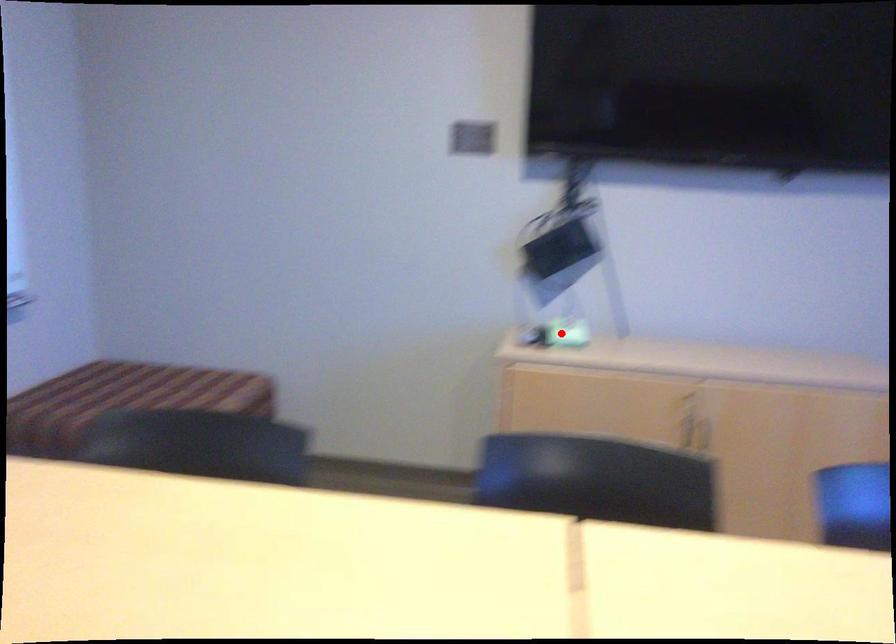
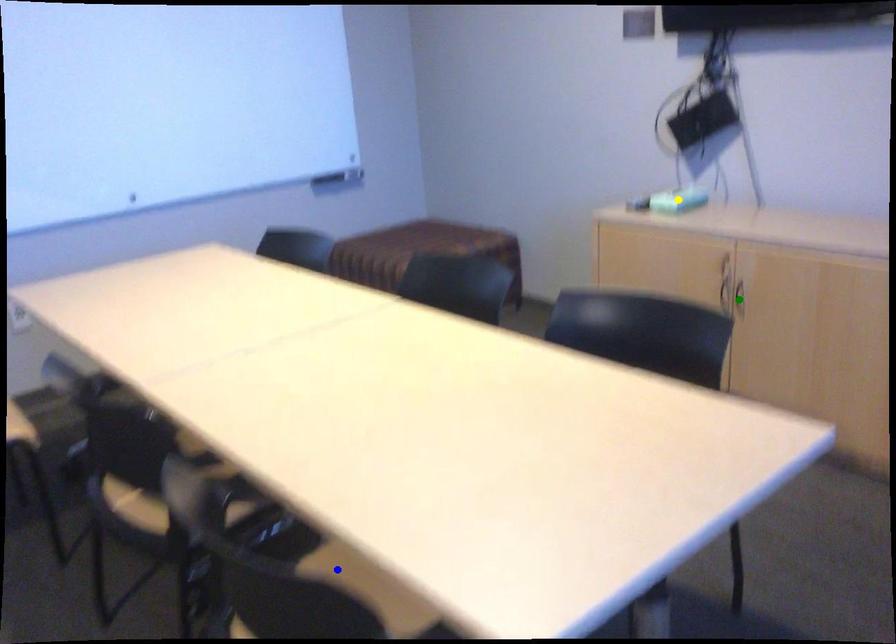
Question: I am providing you with two images of the same scene from different viewpoints. A red point is marked on the first image. You are given multiple points on the second image. Which point in image 2 is actually the same real-world point as the red point in image 1?

Choices:
 (A) yellow point
 (B) green point
 (C) blue point

Answer: (A)